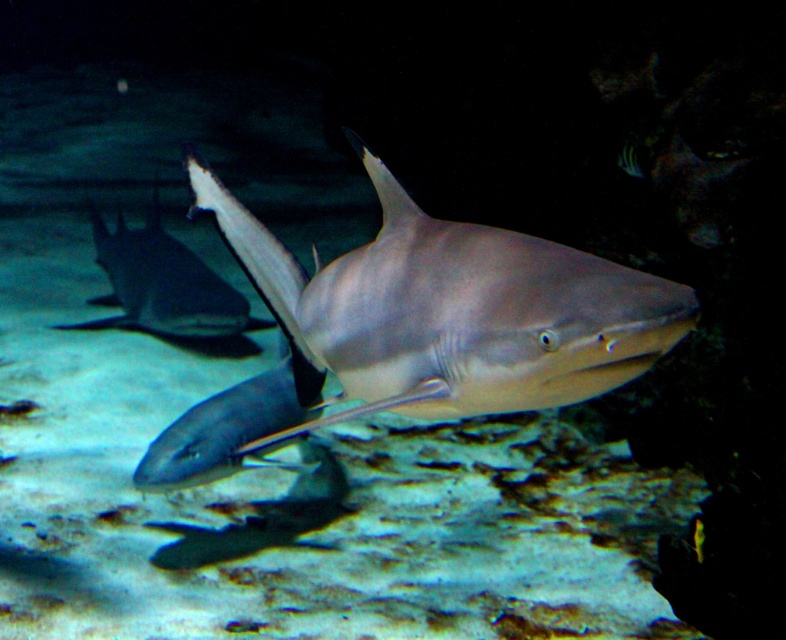
Question: Does smooth gray shark at center appear over smooth gray stingray at center?

Choices:
 (A) no
 (B) yes

Answer: (A)

Question: Which of the following is the farthest from the observer?

Choices:
 (A) smooth gray shark at center
 (B) smooth gray stingray at center

Answer: (B)

Question: Does smooth gray shark at center lie behind smooth gray stingray at center?

Choices:
 (A) no
 (B) yes

Answer: (A)

Question: Does smooth gray shark at center appear over smooth gray stingray at center?

Choices:
 (A) yes
 (B) no

Answer: (B)

Question: Among these points, which one is farthest from the camera?

Choices:
 (A) (196, 308)
 (B) (401, 371)

Answer: (A)